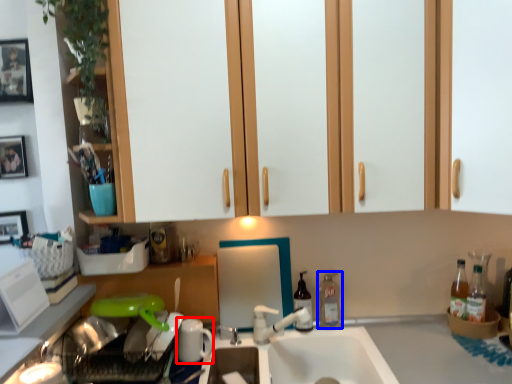
Question: Which of the following is the farthest to the observer, appliance (highlighted by a red box) or bottle (highlighted by a blue box)?

Choices:
 (A) appliance
 (B) bottle

Answer: (B)